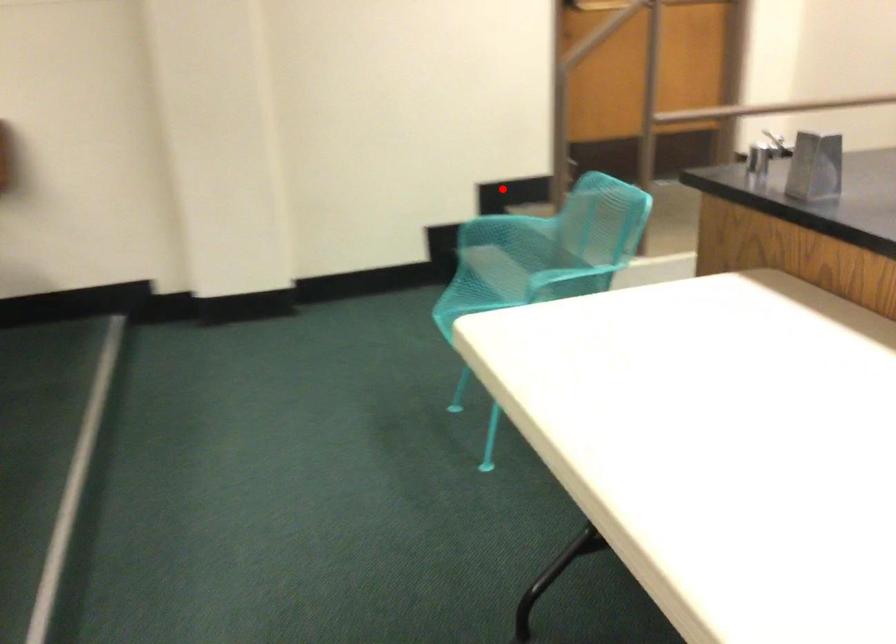
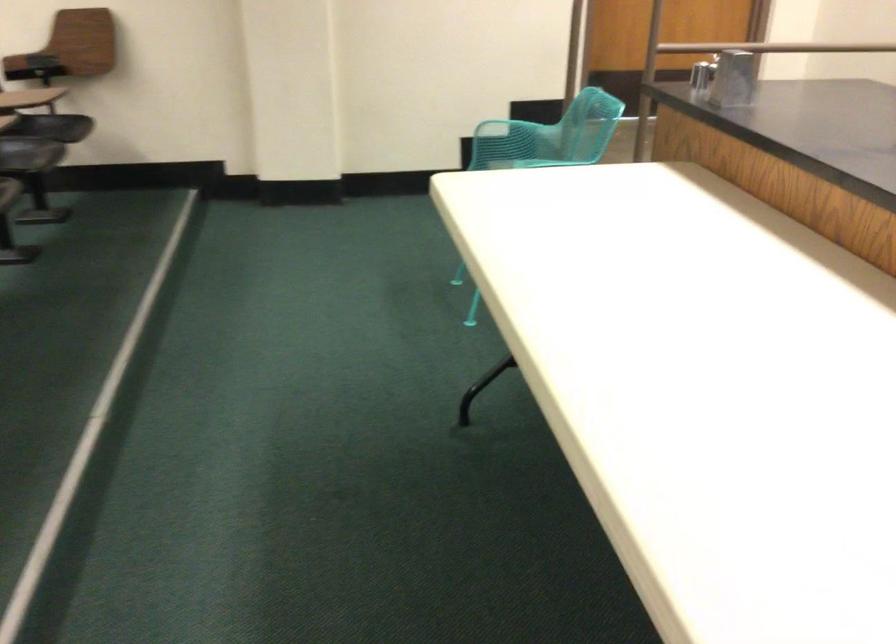
Question: A red point is marked in image1. In image2, is the corresponding 3D point closer to the camera or farther? Reply with the corresponding letter.

Choices:
 (A) The corresponding 3D point is closer.
 (B) The corresponding 3D point is farther.

Answer: (B)